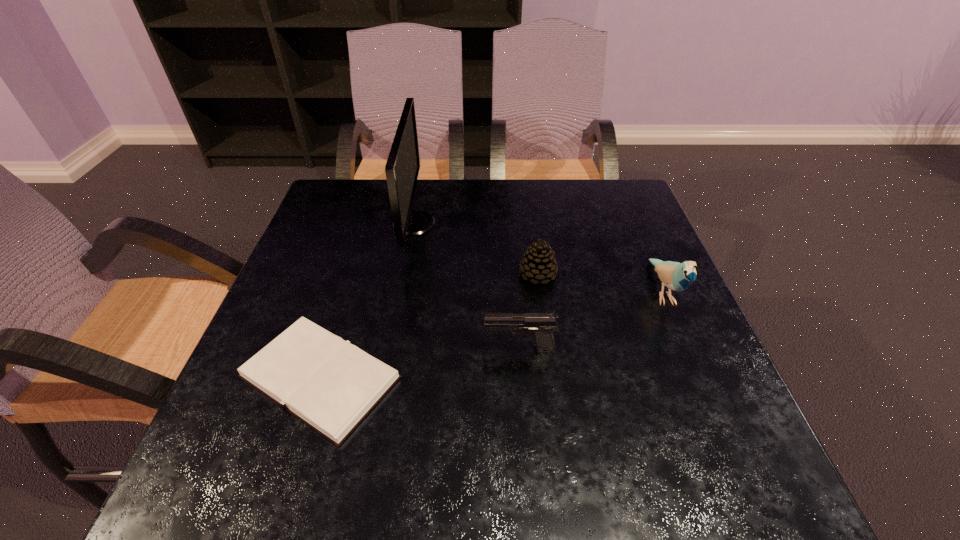
You are a GUI agent. You are given a task and a screenshot of the screen. Output one action in this format:
    pyautogui.click(x=<x>, y=<y>)
    Task: Click on the vacant position located aim along the barrel of the pistol
    The height and width of the screenshot is (540, 960).
    Given the screenshot: What is the action you would take?
    pyautogui.click(x=453, y=349)

Locate an element on the screen. The width and height of the screenshot is (960, 540). vacant region located at the narrow end of the pinecone is located at coordinates (489, 274).

You are a GUI agent. You are given a task and a screenshot of the screen. Output one action in this format:
    pyautogui.click(x=<x>, y=<y>)
    Task: Click on the vacant area situated 0.150m at the narrow end of the pinecone
    The height and width of the screenshot is (540, 960).
    Given the screenshot: What is the action you would take?
    pyautogui.click(x=454, y=274)

Find the location of `free space located at the narrow end of the pinecone`. free space located at the narrow end of the pinecone is located at coordinates (468, 274).

The height and width of the screenshot is (540, 960). Find the location of `free space located on the right of the hardback book`. free space located on the right of the hardback book is located at coordinates (429, 377).

Find the location of a particular element. object situated at the far edge is located at coordinates (402, 168).

At what (x,y) coordinates should I click in order to perform the action: click on object that is at the near edge. Please return your answer as a coordinate pair (x, y). The width and height of the screenshot is (960, 540). Looking at the image, I should click on (331, 385).

Locate an element on the screen. object that is at the left edge is located at coordinates (331, 385).

This screenshot has width=960, height=540. What are the coordinates of `object situated at the right edge` in the screenshot? It's located at (676, 276).

Find the location of `object located in the near left corner section of the desktop`. object located in the near left corner section of the desktop is located at coordinates point(331,385).